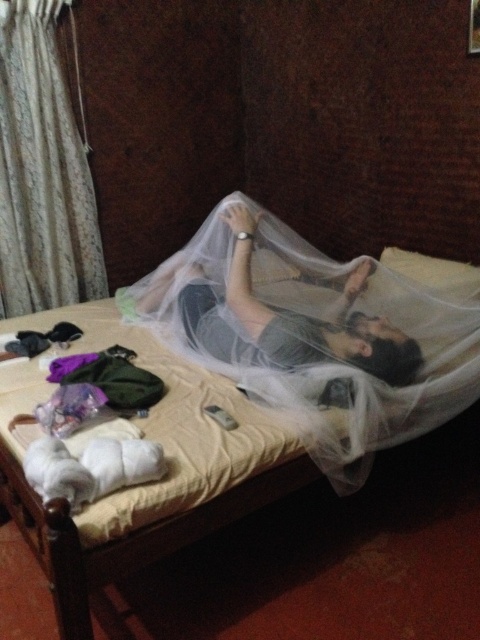
Between white mesh mosquito net at upper center and matte gray fabric at center, which one has more height?

white mesh mosquito net at upper center

Between point (472, 348) and point (334, 339), which one is positioned behind?

Point (472, 348)

Find the location of a particular element. The width and height of the screenshot is (480, 640). white mesh mosquito net at upper center is located at coordinates (276, 374).

Is white mesh mosquito net at upper center positioned behind white textured curtain at upper left?

No, white mesh mosquito net at upper center is in front of white textured curtain at upper left.

Is white mesh mosquito net at upper center wider than white textured curtain at upper left?

Yes, white mesh mosquito net at upper center is wider than white textured curtain at upper left.

Does point (273, 468) come behind point (36, 250)?

That is False.

Find the location of a particular element. This screenshot has height=640, width=480. white mesh mosquito net at upper center is located at coordinates (276, 374).

Which of these two, white textured curtain at upper left or matte gray fabric at center, stands shorter?

matte gray fabric at center is shorter.

This screenshot has height=640, width=480. What do you see at coordinates (41, 172) in the screenshot? I see `white textured curtain at upper left` at bounding box center [41, 172].

Which is behind, point (76, 179) or point (280, 339)?

The point (76, 179) is behind.

Find the location of a particular element. white textured curtain at upper left is located at coordinates (41, 172).